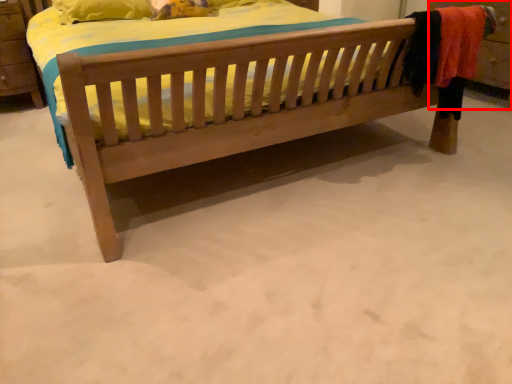
Question: From the image's perspective, what is the correct spatial relationship of dresser (annotated by the red box) in relation to bed?

Choices:
 (A) above
 (B) below

Answer: (A)